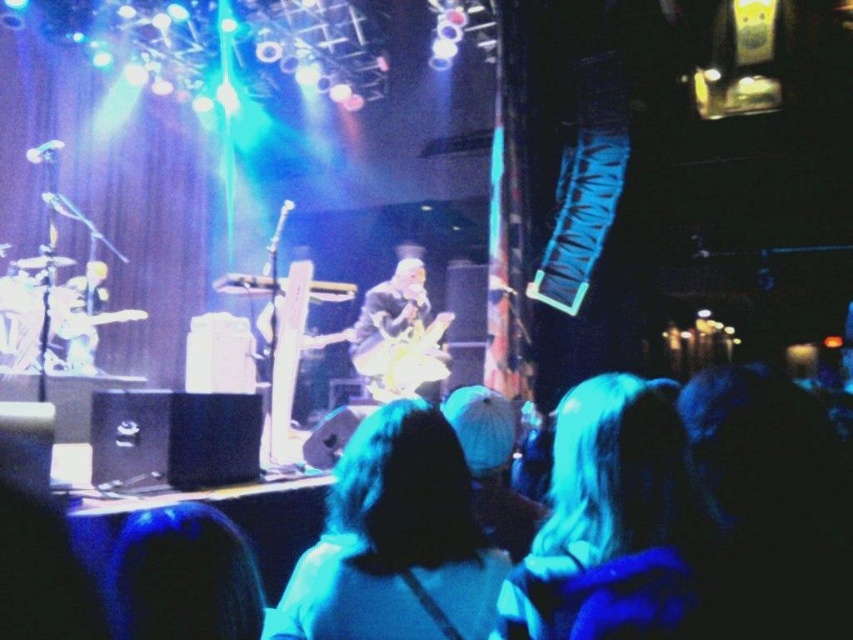
Question: In this image, where is light blue fabric at center located relative to shiny gold guitar at center?

Choices:
 (A) above
 (B) below

Answer: (B)

Question: Which object is positioned closest to the white fabric at center?

Choices:
 (A) shiny gold guitar at center
 (B) light blue fabric at center

Answer: (B)

Question: Can you confirm if light blue fabric at center is positioned to the left of shiny gold guitar at center?

Choices:
 (A) yes
 (B) no

Answer: (B)

Question: Among these points, which one is nearest to the camera?

Choices:
 (A) pyautogui.click(x=440, y=365)
 (B) pyautogui.click(x=374, y=506)
 (C) pyautogui.click(x=660, y=497)

Answer: (C)

Question: Which of the following is the farthest from the observer?

Choices:
 (A) shiny gold guitar at center
 (B) light blue fabric at center

Answer: (A)

Question: In this image, where is light blue fabric at center located relative to shiny gold guitar at center?

Choices:
 (A) right
 (B) left

Answer: (A)